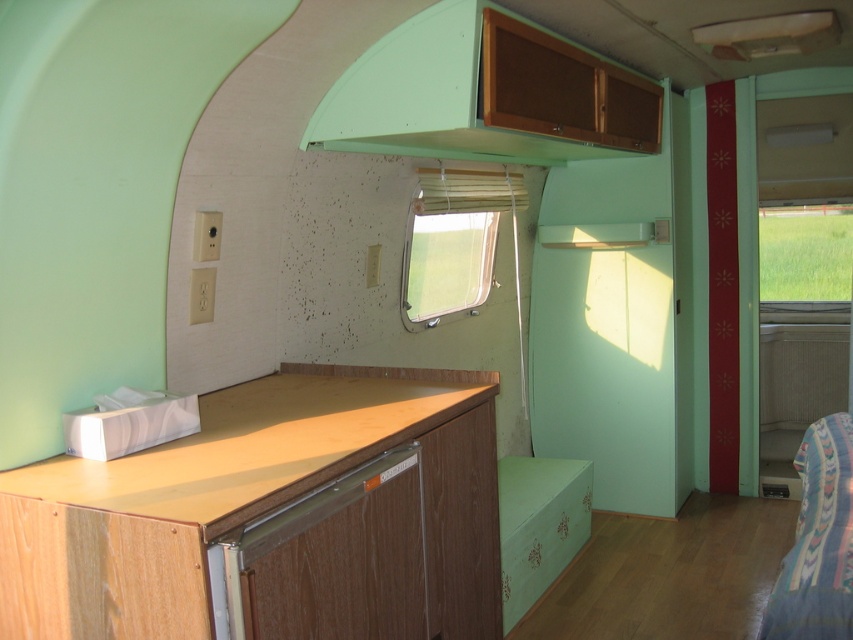
Is point (263, 412) farther from camera compared to point (457, 237)?

No, it is in front of (457, 237).

Who is more forward, (287, 499) or (428, 273)?

Point (287, 499) is in front.

Who is more forward, (321, 480) or (415, 244)?

Point (321, 480) is more forward.

Locate an element on the screen. wooden at lower left is located at coordinates (260, 444).

Is the position of wooden at lower left less distant than that of green glass window at right?

Yes.

Which is more to the left, wooden at lower left or green glass window at right?

From the viewer's perspective, wooden at lower left appears more on the left side.

Is point (233, 396) positioned before point (759, 225)?

Yes.

This screenshot has height=640, width=853. Identify the location of wooden at lower left. (260, 444).

Between point (581, 65) and point (805, 449), which one is positioned behind?

Positioned behind is point (581, 65).

The height and width of the screenshot is (640, 853). Identify the location of matte green cabinet at upper center. (480, 93).